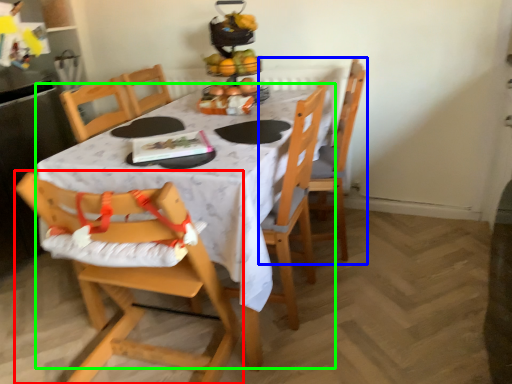
Question: Which object is positioned farthest from chair (highlighted by a red box)? Select from chair (highlighted by a blue box) and table (highlighted by a green box).

Choices:
 (A) chair
 (B) table

Answer: (A)